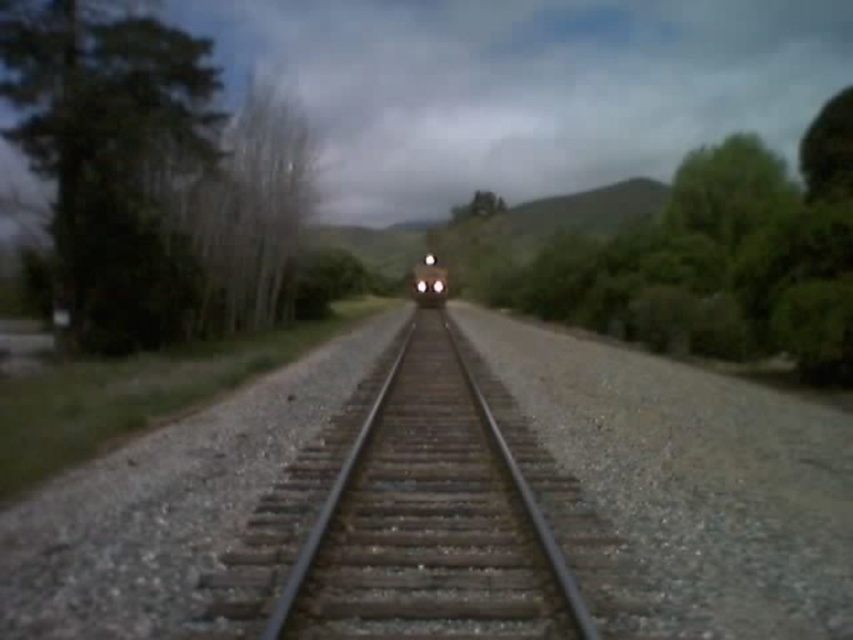
You are a photographer standing at the starting point of the railway track. You want to take a photo that includes both the metal track at center and the matte black train at center. Which object should you focus on first to ensure both are in the frame?

You should focus on the metal track at center first because it is closer to you than the matte black train at center, ensuring both are in the frame.

You are standing at the origin point of the coordinate system in the image. There is a metal track at center located at point (430, 520). Which direction should you move to reach the metal track at center?

To reach the metal track at center located at point (430, 520) from the origin, you should move towards the positive x and positive y directions since the coordinates are both greater than zero.

You are a photographer standing at the starting point of the railway track. You want to capture a photo where the green leafy tree at left and the matte black train at center are both visible. Which object will appear wider in the photo?

The green leafy tree at left will appear wider in the photo because its width is larger than that of the matte black train at center.